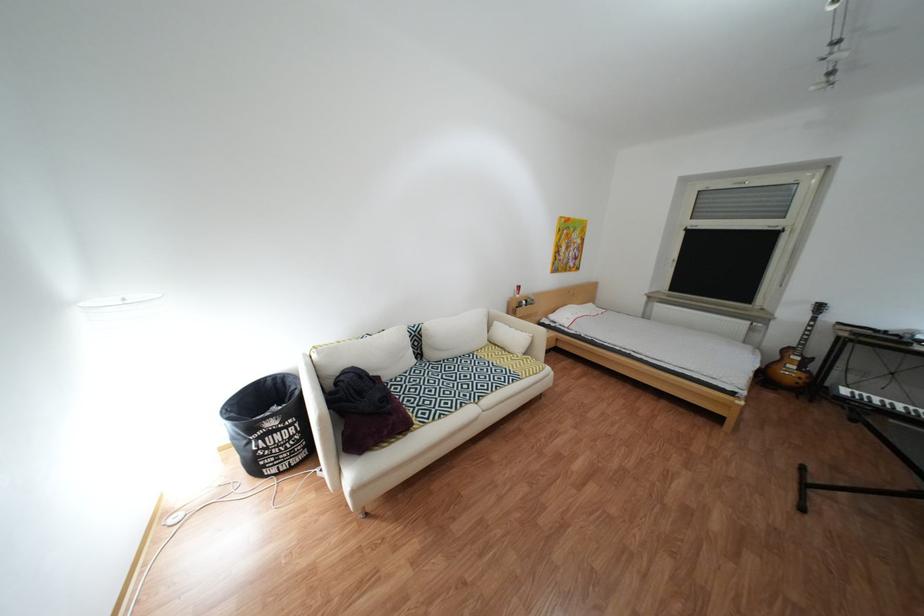
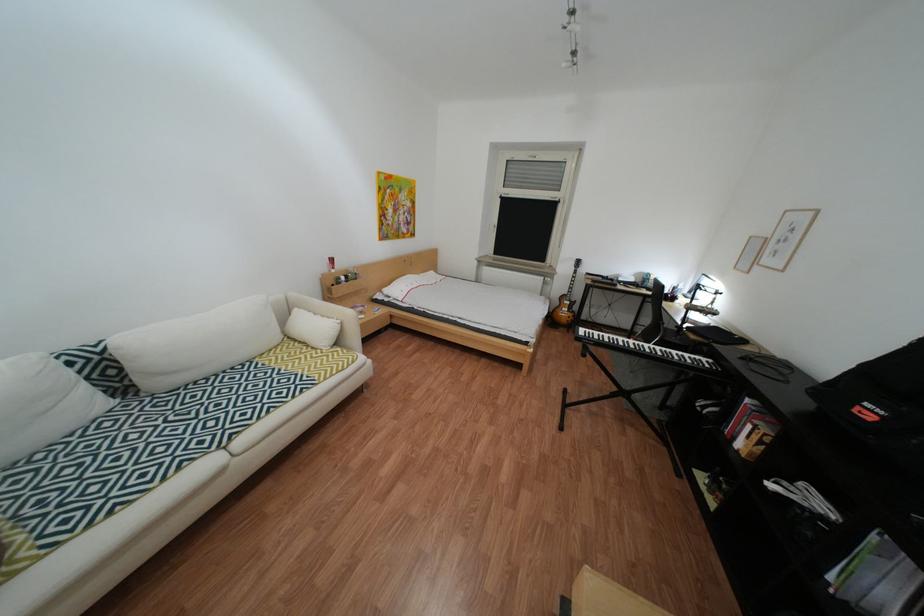
Question: The first image is from the beginning of the video and the second image is from the end. How did the camera likely rotate when shooting the video?

Choices:
 (A) Left
 (B) Right
 (C) Up
 (D) Down

Answer: (B)